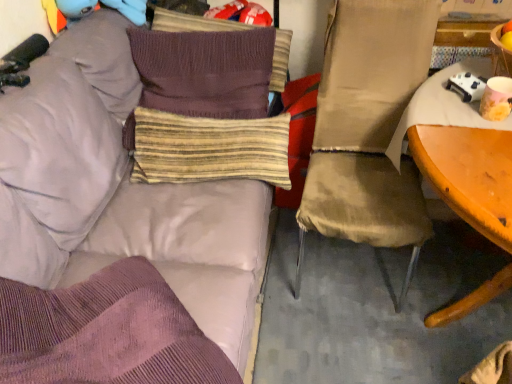
Question: Is knitted brown pillow at upper center, placed as the 4th pillow when sorted from bottom to top, facing towards knitted brown pillow at center, which ranks as the 3th pillow in bottom-to-top order?

Choices:
 (A) yes
 (B) no

Answer: (A)

Question: Considering the relative sizes of knitted brown pillow at upper center, the 1th pillow when ordered from top to bottom, and knitted brown pillow at center, which ranks as the 3th pillow in bottom-to-top order, in the image provided, is knitted brown pillow at upper center, the 1th pillow when ordered from top to bottom, thinner than knitted brown pillow at center, which ranks as the 3th pillow in bottom-to-top order,?

Choices:
 (A) yes
 (B) no

Answer: (A)

Question: Is knitted brown pillow at upper center, placed as the 4th pillow when sorted from bottom to top, looking in the opposite direction of knitted brown pillow at center, the 2th pillow from the top?

Choices:
 (A) yes
 (B) no

Answer: (A)

Question: Does knitted brown pillow at upper center, the 1th pillow when ordered from top to bottom, come in front of knitted brown pillow at center, which ranks as the 3th pillow in bottom-to-top order?

Choices:
 (A) no
 (B) yes

Answer: (A)

Question: Is knitted brown pillow at upper center, the 1th pillow when ordered from top to bottom, not within knitted brown pillow at center, which ranks as the 3th pillow in bottom-to-top order?

Choices:
 (A) yes
 (B) no

Answer: (B)

Question: Considering the positions of matte yellow cup at right and knitted brown pillow at center, which ranks as the 3th pillow in bottom-to-top order, in the image, is matte yellow cup at right wider or thinner than knitted brown pillow at center, which ranks as the 3th pillow in bottom-to-top order,?

Choices:
 (A) thin
 (B) wide

Answer: (A)

Question: Is point (493, 87) positioned closer to the camera than point (202, 59)?

Choices:
 (A) closer
 (B) farther

Answer: (A)

Question: Relative to knitted brown pillow at center, the 2th pillow from the top, is matte yellow cup at right in front or behind?

Choices:
 (A) behind
 (B) front

Answer: (B)

Question: From a real-world perspective, is matte yellow cup at right physically located above or below knitted brown pillow at center, which ranks as the 3th pillow in bottom-to-top order?

Choices:
 (A) above
 (B) below

Answer: (A)

Question: Is knitted brown pillow at upper center, placed as the 4th pillow when sorted from bottom to top, in front of or behind matte beige chair at right in the image?

Choices:
 (A) front
 (B) behind

Answer: (B)

Question: Is knitted brown pillow at upper center, placed as the 4th pillow when sorted from bottom to top, to the left or to the right of matte beige chair at right in the image?

Choices:
 (A) right
 (B) left

Answer: (B)

Question: Is knitted brown pillow at upper center, the 1th pillow when ordered from top to bottom, taller or shorter than matte beige chair at right?

Choices:
 (A) short
 (B) tall

Answer: (A)

Question: Does point (173, 13) appear closer or farther from the camera than point (300, 226)?

Choices:
 (A) farther
 (B) closer

Answer: (A)

Question: Visually, is striped fabric pillow at center, the first pillow when ordered from bottom to top, positioned to the left or to the right of matte beige chair at right?

Choices:
 (A) left
 (B) right

Answer: (A)

Question: Which is correct: striped fabric pillow at center, the fourth pillow when ordered from top to bottom, is inside matte beige chair at right, or outside of it?

Choices:
 (A) outside
 (B) inside

Answer: (A)